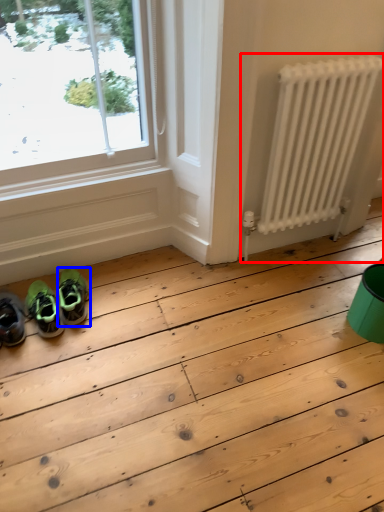
Question: Which point is closer to the camera, radiator (highlighted by a red box) or footwear (highlighted by a blue box)?

Choices:
 (A) radiator
 (B) footwear

Answer: (A)